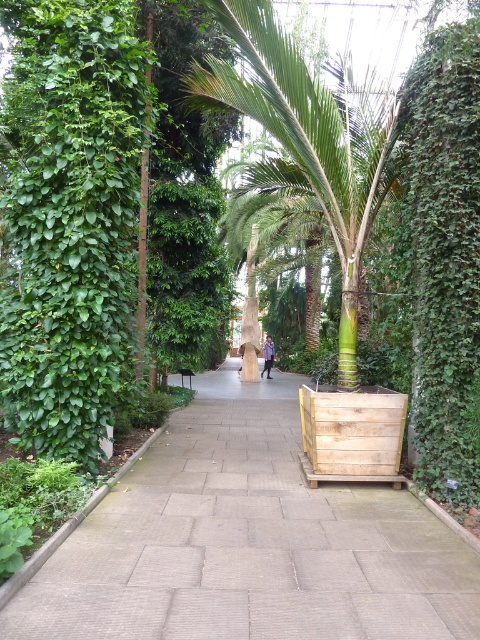
Question: Considering the real-world distances, which object is farthest from the light blue denim jacket at center?

Choices:
 (A) green leafy hedge at right
 (B) green textured palm tree at center
 (C) brown stone pavement at center

Answer: (A)

Question: Which object appears closest to the camera in this image?

Choices:
 (A) brown stone pavement at center
 (B) green textured palm tree at center
 (C) green leafy hedge at right
 (D) light blue denim jacket at center

Answer: (A)

Question: Is green leafy hedge at right further to the viewer compared to light blue denim jacket at center?

Choices:
 (A) no
 (B) yes

Answer: (A)

Question: Which of the following is the farthest from the observer?

Choices:
 (A) green textured palm tree at center
 (B) light blue denim jacket at center

Answer: (B)

Question: Can you confirm if green leafy hedge at right is thinner than light blue denim jacket at center?

Choices:
 (A) yes
 (B) no

Answer: (B)

Question: Is brown stone pavement at center positioned behind green textured palm tree at center?

Choices:
 (A) no
 (B) yes

Answer: (A)